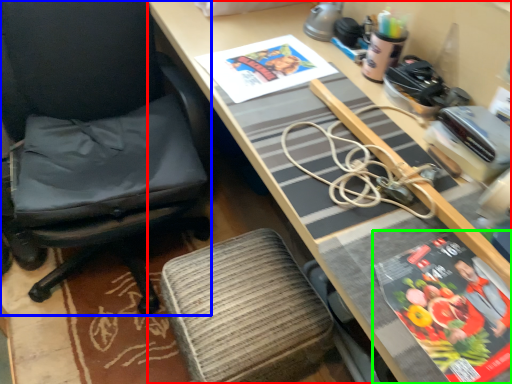
Question: Based on their relative distances, which object is nearer to desk (highlighted by a red box)? Choose from chair (highlighted by a blue box) and paperback book (highlighted by a green box).

Choices:
 (A) chair
 (B) paperback book

Answer: (B)